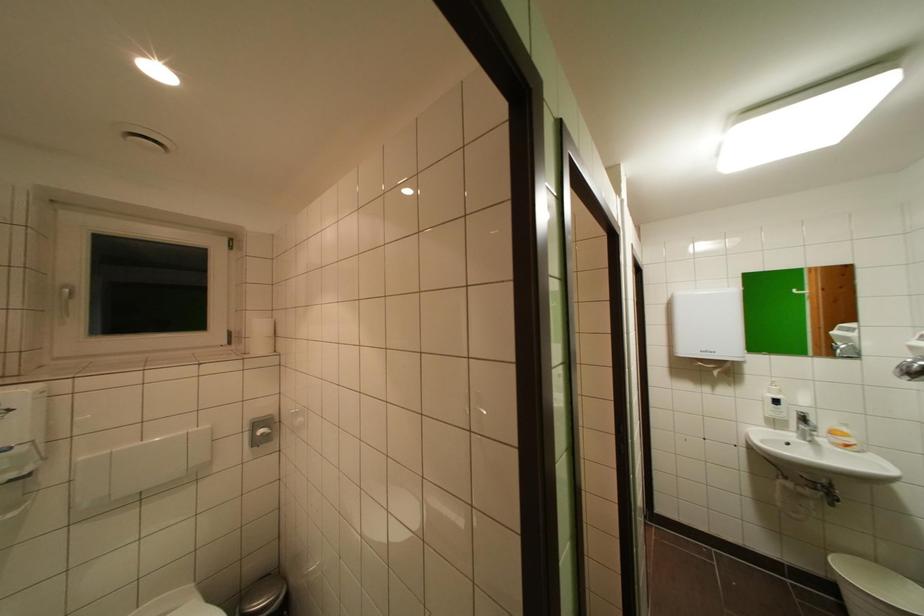
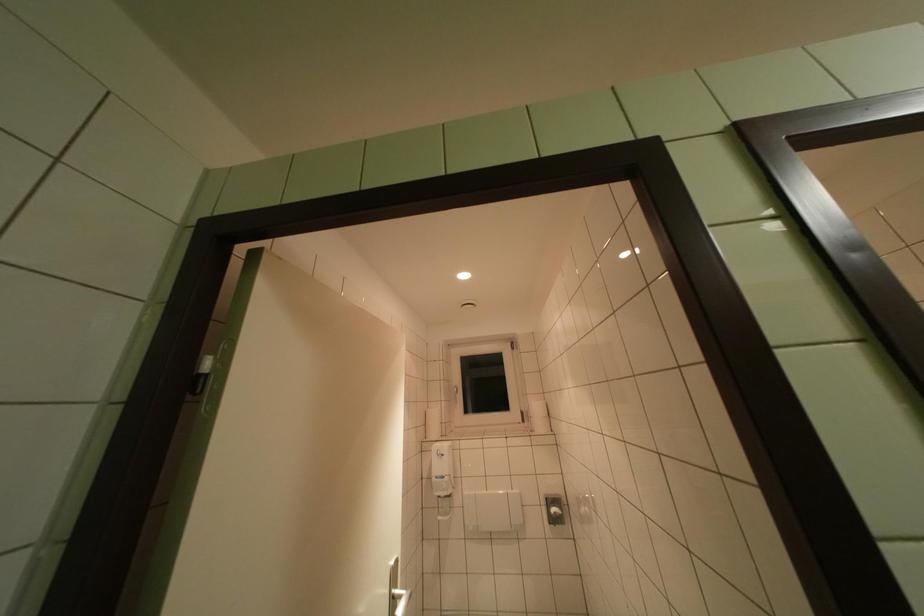
Based on the continuous images, in which direction is the camera rotating?

The camera rotated toward left-up.